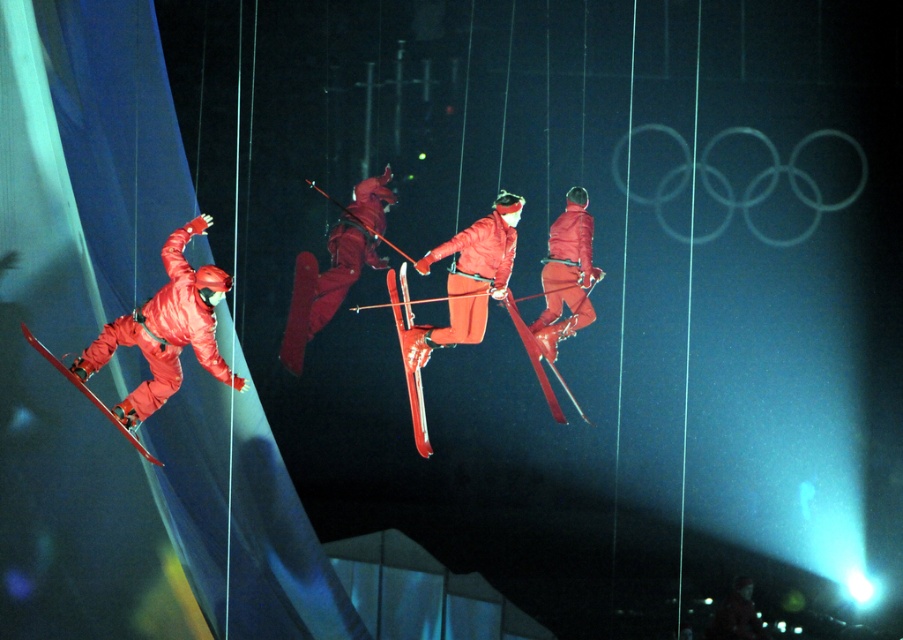
You are a safety inspector checking the equipment setup for the aerial stunt. The safety protocol requires that the distance between the performer wearing the matte red ski suit at center and their metallic red skis at center must be less than 1.30 meters to ensure stability. Is the current setup compliant with the safety protocol?

The distance between the matte red ski suit at center and metallic red skis at center is 1.40 meters, which exceeds the 1.30 meters requirement. Therefore, the current setup does not comply with the safety protocol.

You are a photographer trying to capture the exact center of the image. You notice a point at coordinates point (469, 278). What object is located at that point?

The point (469, 278) is located on the matte orange ski suit at center.